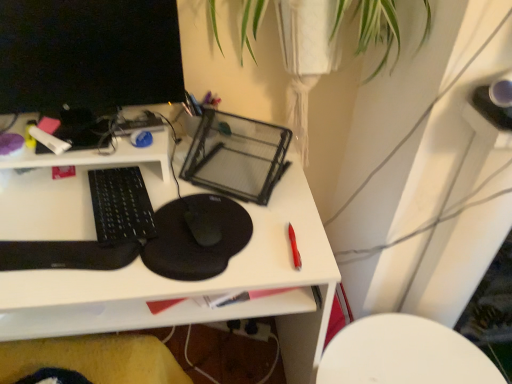
This screenshot has width=512, height=384. In order to click on free space between black matte mousepad at center and red plastic pen at right, which is the first stationery from front to back in this screenshot , I will do coord(264,239).